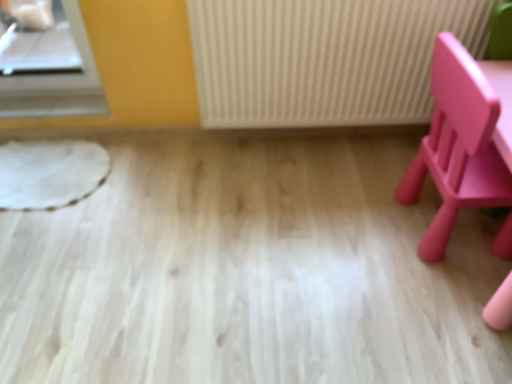
Question: Is matte pink chair at right wider or thinner than white textured radiator at center?

Choices:
 (A) wide
 (B) thin

Answer: (A)

Question: In the image, is matte pink chair at right on the left side or the right side of white textured radiator at center?

Choices:
 (A) right
 (B) left

Answer: (A)

Question: From their relative heights in the image, would you say matte pink chair at right is taller or shorter than white textured radiator at center?

Choices:
 (A) tall
 (B) short

Answer: (A)

Question: In terms of height, does white textured radiator at center look taller or shorter compared to matte pink chair at right?

Choices:
 (A) short
 (B) tall

Answer: (A)

Question: Is white textured radiator at center in front of or behind matte pink chair at right in the image?

Choices:
 (A) behind
 (B) front

Answer: (A)

Question: Considering the relative positions of white textured radiator at center and matte pink chair at right in the image provided, is white textured radiator at center to the left or to the right of matte pink chair at right?

Choices:
 (A) left
 (B) right

Answer: (A)

Question: Considering the positions of white textured radiator at center and matte pink chair at right in the image, is white textured radiator at center wider or thinner than matte pink chair at right?

Choices:
 (A) wide
 (B) thin

Answer: (B)